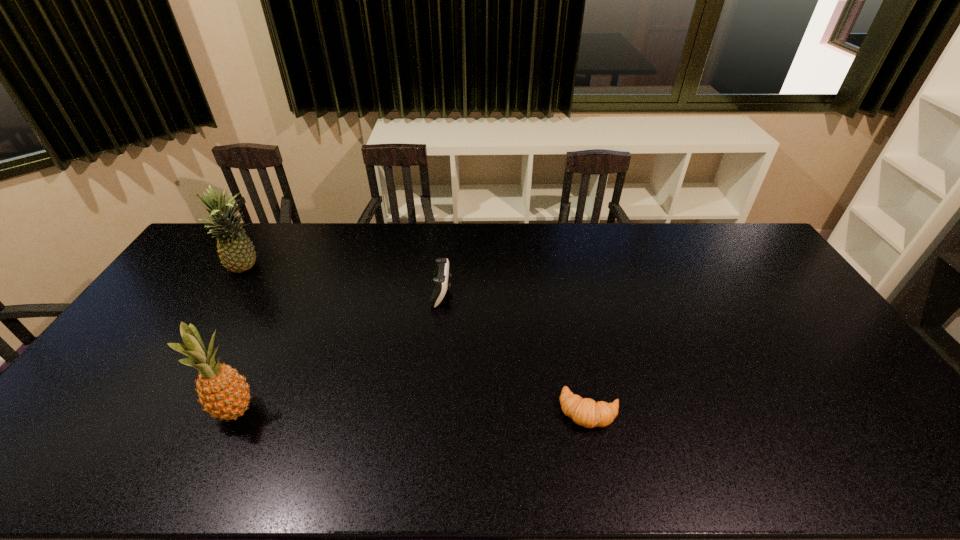
I want to click on the closest object to the right pineapple, so click(236, 251).

At what (x,y) coordinates should I click in order to perform the action: click on blank space that satisfies the following two spatial constraints: 1. on the front side of the third object from right to left; 2. on the right side of the farther pineapple. Please return your answer as a coordinate pair (x, y). Looking at the image, I should click on (156, 410).

Where is `free space in the image that satisfies the following two spatial constraints: 1. on the front side of the farther pineapple; 2. on the right side of the nearer pineapple`? free space in the image that satisfies the following two spatial constraints: 1. on the front side of the farther pineapple; 2. on the right side of the nearer pineapple is located at coordinates (156, 410).

At what (x,y) coordinates should I click in order to perform the action: click on free region that satisfies the following two spatial constraints: 1. on the front-facing side of the rightmost object; 2. on the right side of the control. Please return your answer as a coordinate pair (x, y). Looking at the image, I should click on (430, 411).